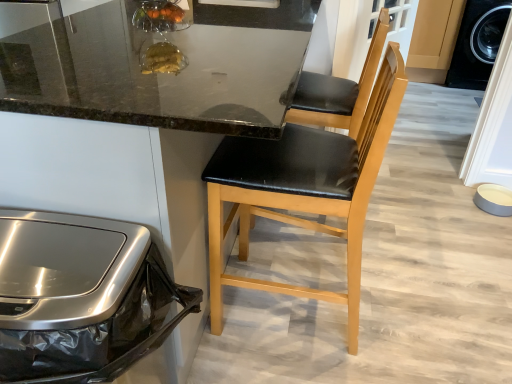
Image resolution: width=512 pixels, height=384 pixels. Describe the element at coordinates (81, 297) in the screenshot. I see `stainless steel trash can at left` at that location.

Find the location of `black leather chair at center`. black leather chair at center is located at coordinates (303, 189).

Locate an element on the screen. This screenshot has height=384, width=512. black leather chair at center is located at coordinates (123, 161).

Does black leather chair at center have a smaller size compared to matte gray bowl at lower right?

No.

From the image's perspective, which object appears higher, black leather chair at center or matte gray bowl at lower right?

black leather chair at center, from the image's perspective.

Does point (138, 201) come farther from viewer compared to point (486, 196)?

No.

Looking at this image, between black leather chair at center and matte gray bowl at lower right, which one has less height?

With less height is matte gray bowl at lower right.

Is point (242, 181) closer or farther from the camera than point (504, 195)?

Clearly, point (242, 181) is closer to the camera than point (504, 195).

Is black leather chair at center in front of or behind matte gray bowl at lower right in the image?

Visually, black leather chair at center is located in front of matte gray bowl at lower right.

Considering the sizes of objects black leather chair at center and matte gray bowl at lower right in the image provided, who is bigger, black leather chair at center or matte gray bowl at lower right?

Bigger between the two is black leather chair at center.

Who is shorter, black leather chair at center or stainless steel trash can at left?

With less height is stainless steel trash can at left.

Considering the sizes of objects black leather chair at center and stainless steel trash can at left in the image provided, who is bigger, black leather chair at center or stainless steel trash can at left?

With larger size is black leather chair at center.

Between black leather chair at center and stainless steel trash can at left, which one is positioned behind?

black leather chair at center is further from the camera.

Is black leather chair at center to the left or to the right of stainless steel trash can at left in the image?

In the image, black leather chair at center appears on the right side of stainless steel trash can at left.

Is black leather chair at center inside or outside of black leather chair at center?

black leather chair at center is spatially positioned inside black leather chair at center.

From a real-world perspective, is black leather chair at center under black leather chair at center?

Indeed, from a real-world perspective, black leather chair at center is positioned beneath black leather chair at center.

Considering the relative sizes of black leather chair at center and black leather chair at center in the image provided, is black leather chair at center shorter than black leather chair at center?

Yes, black leather chair at center is shorter than black leather chair at center.

Between black leather chair at center and black leather chair at center, which one appears on the right side from the viewer's perspective?

From the viewer's perspective, black leather chair at center appears more on the right side.

From the picture: From the image's perspective, which object appears higher, stainless steel trash can at left or black leather chair at center?

black leather chair at center.

Where is `chair positioned vertically above the stainless steel trash can at left (from a real-world perspective)`? chair positioned vertically above the stainless steel trash can at left (from a real-world perspective) is located at coordinates (303, 189).

Could you tell me if stainless steel trash can at left is turned towards black leather chair at center?

No, stainless steel trash can at left is not oriented towards black leather chair at center.

Is stainless steel trash can at left not within black leather chair at center?

Yes, stainless steel trash can at left is outside of black leather chair at center.

How different are the orientations of black leather chair at center and black leather chair at center in degrees?

They differ by 2.89 degrees in their facing directions.

Measure the distance from black leather chair at center to black leather chair at center.

black leather chair at center is 31.82 centimeters away from black leather chair at center.

Does black leather chair at center touch black leather chair at center?

No, black leather chair at center is not with black leather chair at center.

Consider the image. Is black leather chair at center facing towards black leather chair at center?

Yes.

Is matte gray bowl at lower right looking in the opposite direction of black leather chair at center?

No, matte gray bowl at lower right's orientation is not away from black leather chair at center.

Is matte gray bowl at lower right not inside black leather chair at center?

Yes, matte gray bowl at lower right is located beyond the bounds of black leather chair at center.

You are a GUI agent. You are given a task and a screenshot of the screen. Output one action in this format:
    pyautogui.click(x=<x>, y=<y>)
    Task: Click on the bowl below the black leather chair at center (from the image's perspective)
    The width and height of the screenshot is (512, 384).
    Given the screenshot: What is the action you would take?
    pyautogui.click(x=494, y=199)

The height and width of the screenshot is (384, 512). In order to click on bowl located behind the black leather chair at center in this screenshot , I will do `click(494, 199)`.

Consider the image. From the image, which object appears to be farther from black leather chair at center, stainless steel trash can at left or black leather chair at center?

black leather chair at center.

Considering their positions, is black leather chair at center positioned further to stainless steel trash can at left than black leather chair at center?

black leather chair at center lies further to stainless steel trash can at left than the other object.

From the image, which object appears to be farther from stainless steel trash can at left, matte gray bowl at lower right or black leather chair at center?

matte gray bowl at lower right is positioned further to the anchor stainless steel trash can at left.

From the image, which object appears to be nearer to black leather chair at center, matte gray bowl at lower right or stainless steel trash can at left?

stainless steel trash can at left is positioned closer to the anchor black leather chair at center.

When comparing their distances from stainless steel trash can at left, does black leather chair at center or matte gray bowl at lower right seem closer?

Based on the image, black leather chair at center appears to be nearer to stainless steel trash can at left.

Based on their spatial positions, is stainless steel trash can at left or black leather chair at center further from matte gray bowl at lower right?

The object further to matte gray bowl at lower right is stainless steel trash can at left.

When comparing their distances from matte gray bowl at lower right, does black leather chair at center or black leather chair at center seem closer?

black leather chair at center lies closer to matte gray bowl at lower right than the other object.

Consider the image. Looking at the image, which one is located further to stainless steel trash can at left, black leather chair at center or matte gray bowl at lower right?

matte gray bowl at lower right.

The width and height of the screenshot is (512, 384). I want to click on chair between black leather chair at center and stainless steel trash can at left vertically, so click(x=303, y=189).

In order to click on chair situated between black leather chair at center and matte gray bowl at lower right from left to right in this screenshot , I will do `click(303, 189)`.

I want to click on cabinetry located between stainless steel trash can at left and matte gray bowl at lower right in the left-right direction, so click(123, 161).

I want to click on chair between stainless steel trash can at left and matte gray bowl at lower right, so click(x=303, y=189).